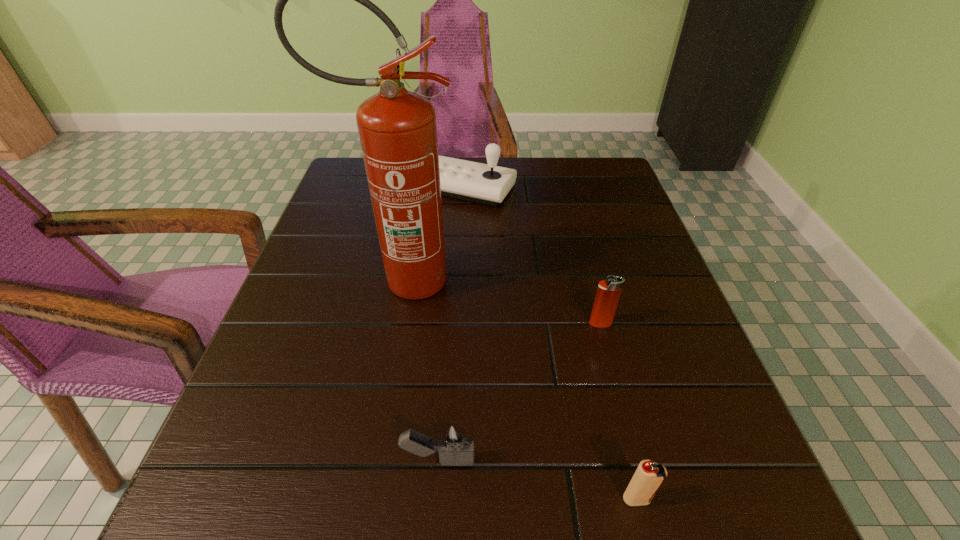
You are a GUI agent. You are given a task and a screenshot of the screen. Output one action in this format:
    pyautogui.click(x=<x>, y=<y>)
    Task: Click on the free point that satisfies the following two spatial constraints: 1. on the back side of the third farthest object; 2. from the nozzle of the second farthest object
    This screenshot has height=540, width=960.
    Given the screenshot: What is the action you would take?
    pyautogui.click(x=589, y=281)

At what (x,y) coordinates should I click in order to perform the action: click on free space that satisfies the following two spatial constraints: 1. on the front side of the farthest object; 2. from the nozzle of the fire extinguisher. Please return your answer as a coordinate pair (x, y). This screenshot has width=960, height=540. Looking at the image, I should click on pyautogui.click(x=459, y=281).

Identify the location of vacant space that satisfies the following two spatial constraints: 1. on the back side of the leftmost igniter; 2. from the nozzle of the tallest object. (451, 281).